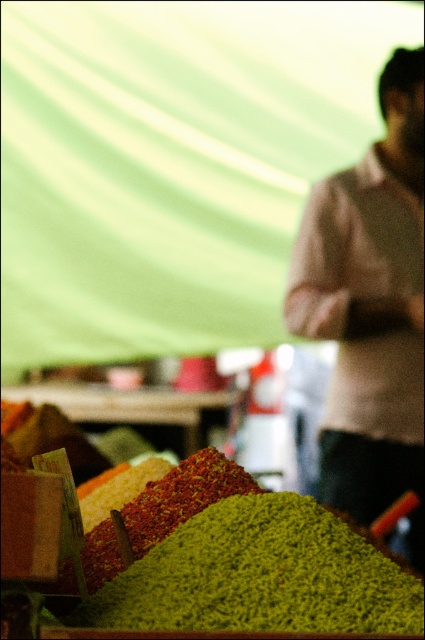
Question: Which object appears farthest from the camera in this image?

Choices:
 (A) green granular spice at center
 (B) light brown sweater at right

Answer: (B)

Question: Which is farther from the light brown sweater at right?

Choices:
 (A) green granular spices at center
 (B) green granular spice at center

Answer: (B)

Question: Considering the relative positions of light brown sweater at right and green granular spices at center in the image provided, where is light brown sweater at right located with respect to green granular spices at center?

Choices:
 (A) right
 (B) left

Answer: (A)

Question: Which object appears closest to the camera in this image?

Choices:
 (A) green granular spices at center
 (B) light brown sweater at right

Answer: (A)

Question: Can you confirm if light brown sweater at right is positioned to the right of green granular spices at center?

Choices:
 (A) yes
 (B) no

Answer: (A)

Question: Can you confirm if light brown sweater at right is positioned to the left of green granular spice at center?

Choices:
 (A) no
 (B) yes

Answer: (A)